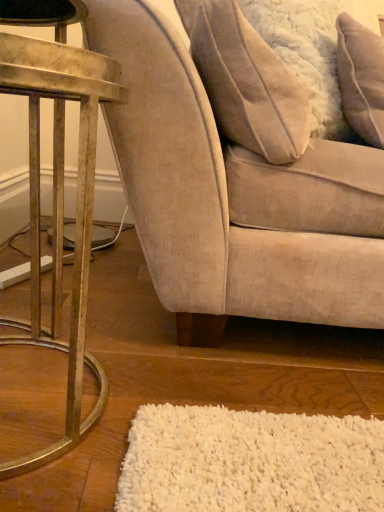
In order to click on metallic gold table at left in this screenshot , I will do [76, 215].

Image resolution: width=384 pixels, height=512 pixels. I want to click on beige fabric chair at center, so click(x=237, y=176).

Which is in front, point (251, 52) or point (215, 16)?

The point (215, 16) is in front.

Considering the positions of objects beige fabric pillow at upper right, which is counted as the 2th pillow, starting from the right, and beige fabric chair at center in the image provided, who is more to the left, beige fabric pillow at upper right, which is counted as the 2th pillow, starting from the right, or beige fabric chair at center?

beige fabric pillow at upper right, which is counted as the 2th pillow, starting from the right.

From the image's perspective, which pillow is the 1st one above the beige fabric chair at center? Please provide its 2D coordinates.

[(246, 82)]

From a real-world perspective, is beige fabric pillow at upper right, which is counted as the 2th pillow, starting from the right, positioned above or below beige fabric chair at center?

beige fabric pillow at upper right, which is counted as the 2th pillow, starting from the right, is above beige fabric chair at center.

Does point (96, 370) appear closer or farther from the camera than point (255, 51)?

Point (96, 370) appears to be farther away from the viewer than point (255, 51).

Is metallic gold table at left facing away from beige fabric chair at center?

metallic gold table at left does not have its back to beige fabric chair at center.

Identify the location of chair behind the metallic gold table at left. The width and height of the screenshot is (384, 512). (237, 176).

Is metallic gold table at left next to beige fabric chair at center?

No, metallic gold table at left is not beside beige fabric chair at center.

Looking at this image, from the image's perspective, which one is positioned higher, metallic gold table at left or white fluffy pillow at upper right, the first pillow in the right-to-left sequence?

white fluffy pillow at upper right, the first pillow in the right-to-left sequence.

Would you say metallic gold table at left is a long distance from white fluffy pillow at upper right, the first pillow in the right-to-left sequence?

metallic gold table at left is near white fluffy pillow at upper right, the first pillow in the right-to-left sequence, not far away.

Can you confirm if metallic gold table at left is positioned to the right of white fluffy pillow at upper right, the first pillow in the right-to-left sequence?

Incorrect, metallic gold table at left is not on the right side of white fluffy pillow at upper right, the first pillow in the right-to-left sequence.

Is metallic gold table at left located outside white fluffy pillow at upper right, the second pillow from the left?

Yes, metallic gold table at left is outside of white fluffy pillow at upper right, the second pillow from the left.

From a real-world perspective, is beige fabric chair at center located higher than beige fabric pillow at upper right, positioned as the 1th pillow in left-to-right order?

No.

Is beige fabric pillow at upper right, which is counted as the 2th pillow, starting from the right, at the back of beige fabric chair at center?

Yes, beige fabric pillow at upper right, which is counted as the 2th pillow, starting from the right, is at the back of beige fabric chair at center.

Is beige fabric chair at center located outside beige fabric pillow at upper right, which is counted as the 2th pillow, starting from the right?

Yes, beige fabric chair at center is not within beige fabric pillow at upper right, which is counted as the 2th pillow, starting from the right.

Are beige fabric chair at center and beige fabric pillow at upper right, which is counted as the 2th pillow, starting from the right, making contact?

There is a gap between beige fabric chair at center and beige fabric pillow at upper right, which is counted as the 2th pillow, starting from the right.

From a real-world perspective, relative to beige fabric chair at center, is white fluffy pillow at upper right, the first pillow in the right-to-left sequence, vertically above or below?

In terms of real-world spatial position, white fluffy pillow at upper right, the first pillow in the right-to-left sequence, is above beige fabric chair at center.

Which is closer to the camera, (372,82) or (353,191)?

The point (353,191) is closer to the camera.

Between white fluffy pillow at upper right, the first pillow in the right-to-left sequence, and beige fabric chair at center, which one has larger size?

With larger size is beige fabric chair at center.

Is white fluffy pillow at upper right, the first pillow in the right-to-left sequence, not inside beige fabric chair at center?

Actually, white fluffy pillow at upper right, the first pillow in the right-to-left sequence, is at least partially inside beige fabric chair at center.

Which is in front, point (293, 152) or point (342, 42)?

Positioned in front is point (293, 152).

From the image's perspective, is beige fabric pillow at upper right, which is counted as the 2th pillow, starting from the right, above or below white fluffy pillow at upper right, the second pillow from the left?

Clearly, from the image's perspective, beige fabric pillow at upper right, which is counted as the 2th pillow, starting from the right, is below white fluffy pillow at upper right, the second pillow from the left.

Is beige fabric pillow at upper right, positioned as the 1th pillow in left-to-right order, with white fluffy pillow at upper right, the second pillow from the left?

There is a gap between beige fabric pillow at upper right, positioned as the 1th pillow in left-to-right order, and white fluffy pillow at upper right, the second pillow from the left.

The width and height of the screenshot is (384, 512). I want to click on table below the white fluffy pillow at upper right, the first pillow in the right-to-left sequence (from a real-world perspective), so click(x=76, y=215).

Considering the positions of objects white fluffy pillow at upper right, the second pillow from the left, and metallic gold table at left in the image provided, who is behind, white fluffy pillow at upper right, the second pillow from the left, or metallic gold table at left?

white fluffy pillow at upper right, the second pillow from the left, is further from the camera.

From a real-world perspective, is white fluffy pillow at upper right, the first pillow in the right-to-left sequence, positioned under metallic gold table at left based on gravity?

No, from a real-world perspective, white fluffy pillow at upper right, the first pillow in the right-to-left sequence, is not under metallic gold table at left.

From the image's perspective, is white fluffy pillow at upper right, the first pillow in the right-to-left sequence, located above metallic gold table at left?

Yes.

From the image's perspective, starting from the beige fabric chair at center, which pillow is the 1st one above? Please provide its 2D coordinates.

[(246, 82)]

Where is `table on the left of beige fabric chair at center`? The image size is (384, 512). table on the left of beige fabric chair at center is located at coordinates (76, 215).

Based on their spatial positions, is beige fabric chair at center or white fluffy pillow at upper right, the second pillow from the left, closer to metallic gold table at left?

The object closer to metallic gold table at left is beige fabric chair at center.

Which object lies further to the anchor point beige fabric pillow at upper right, positioned as the 1th pillow in left-to-right order, white fluffy pillow at upper right, the second pillow from the left, or beige fabric chair at center?

white fluffy pillow at upper right, the second pillow from the left, is further to beige fabric pillow at upper right, positioned as the 1th pillow in left-to-right order.

From the image, which object appears to be nearer to beige fabric chair at center, beige fabric pillow at upper right, which is counted as the 2th pillow, starting from the right, or white fluffy pillow at upper right, the second pillow from the left?

beige fabric pillow at upper right, which is counted as the 2th pillow, starting from the right, is closer to beige fabric chair at center.

Consider the image. Based on their spatial positions, is metallic gold table at left or beige fabric pillow at upper right, which is counted as the 2th pillow, starting from the right, closer to white fluffy pillow at upper right, the first pillow in the right-to-left sequence?

Based on the image, beige fabric pillow at upper right, which is counted as the 2th pillow, starting from the right, appears to be nearer to white fluffy pillow at upper right, the first pillow in the right-to-left sequence.

Based on their spatial positions, is beige fabric chair at center or beige fabric pillow at upper right, positioned as the 1th pillow in left-to-right order, closer to white fluffy pillow at upper right, the first pillow in the right-to-left sequence?

beige fabric chair at center is closer to white fluffy pillow at upper right, the first pillow in the right-to-left sequence.

Estimate the real-world distances between objects in this image. Which object is closer to beige fabric chair at center, white fluffy pillow at upper right, the second pillow from the left, or metallic gold table at left?

metallic gold table at left is positioned closer to the anchor beige fabric chair at center.

From the picture: From the image, which object appears to be nearer to metallic gold table at left, beige fabric pillow at upper right, positioned as the 1th pillow in left-to-right order, or beige fabric chair at center?

beige fabric chair at center.

Looking at the image, which one is located closer to beige fabric pillow at upper right, which is counted as the 2th pillow, starting from the right, white fluffy pillow at upper right, the second pillow from the left, or metallic gold table at left?

white fluffy pillow at upper right, the second pillow from the left, is closer to beige fabric pillow at upper right, which is counted as the 2th pillow, starting from the right.

Image resolution: width=384 pixels, height=512 pixels. Identify the location of pillow between metallic gold table at left and white fluffy pillow at upper right, the first pillow in the right-to-left sequence, in the horizontal direction. (246, 82).

I want to click on pillow located between metallic gold table at left and beige fabric chair at center in the left-right direction, so click(x=246, y=82).

Locate an element on the screen. Image resolution: width=384 pixels, height=512 pixels. chair situated between metallic gold table at left and white fluffy pillow at upper right, the second pillow from the left, from left to right is located at coordinates (237, 176).

The width and height of the screenshot is (384, 512). In order to click on chair situated between beige fabric pillow at upper right, positioned as the 1th pillow in left-to-right order, and white fluffy pillow at upper right, the first pillow in the right-to-left sequence, from left to right in this screenshot , I will do `click(237, 176)`.